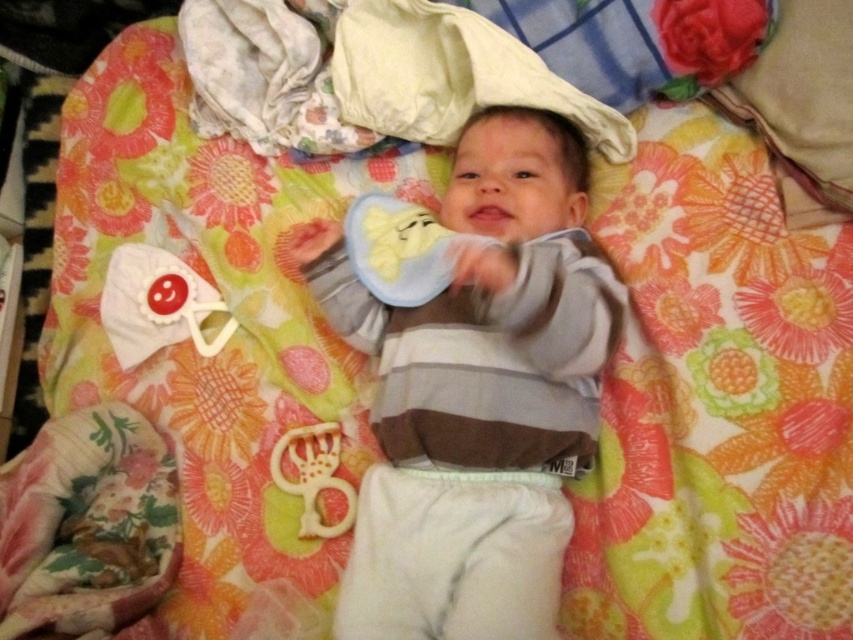
Question: Which point is farther to the camera?

Choices:
 (A) white fabric toy at upper left
 (B) striped cotton onesie at center

Answer: (A)

Question: Which point appears farthest from the camera in this image?

Choices:
 (A) (450, 144)
 (B) (567, 268)
 (C) (212, 352)

Answer: (C)

Question: Is white fabric pillow at upper center thinner than white fabric toy at upper left?

Choices:
 (A) no
 (B) yes

Answer: (A)

Question: Does white fabric pillow at upper center have a larger size compared to white plastic teething ring at lower center?

Choices:
 (A) yes
 (B) no

Answer: (A)

Question: Is striped cotton onesie at center to the right of white fabric toy at upper left from the viewer's perspective?

Choices:
 (A) no
 (B) yes

Answer: (B)

Question: Which point is closer to the camera?

Choices:
 (A) (322, 445)
 (B) (141, 288)
 (C) (485, 292)
 (D) (549, 81)

Answer: (C)